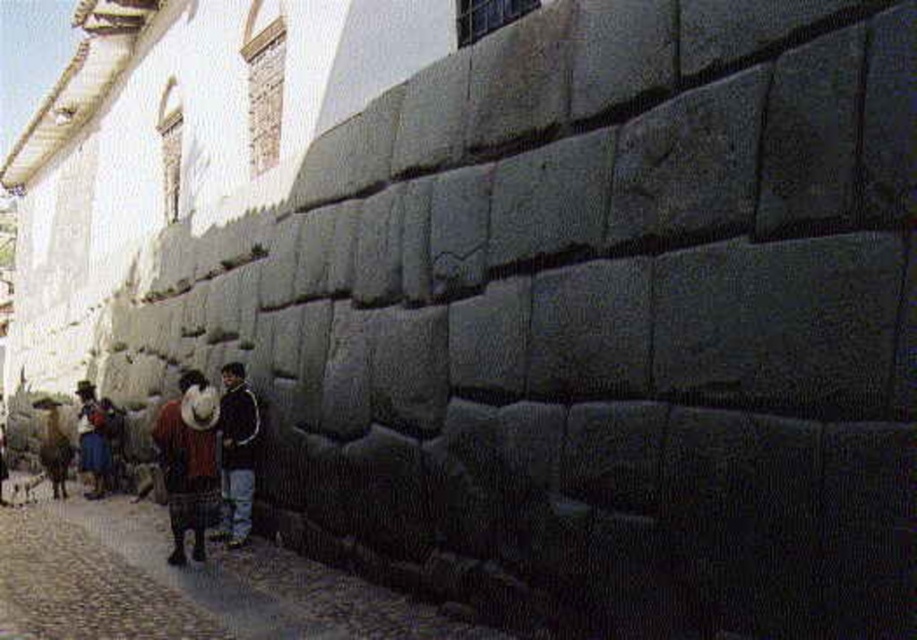
You are standing on the cobblestone street in front of the ancient stone wall. There is a point marked at coordinates (186, 582). What does this point indicate?

The point at coordinates (186, 582) marks the location of the dark gray stone wall at lower left.

You are standing in front of the ancient stone wall and notice two points marked on the wall. The first point is at coordinates point (158, 541) and the second is at point (180, 456). If you were to walk towards the wall, which point would you encounter first?

Point (158, 541) is closer to the viewer than point (180, 456), so you would encounter point (158, 541) first as you approach the wall.

In the scene shown: You are a tour guide explaining the ancient architecture to visitors. You point to the dark gray stone wall at lower left and the knitted wool sweater at center. Which object is shorter in height?

The dark gray stone wall at lower left is shorter in height compared to the knitted wool sweater at center.